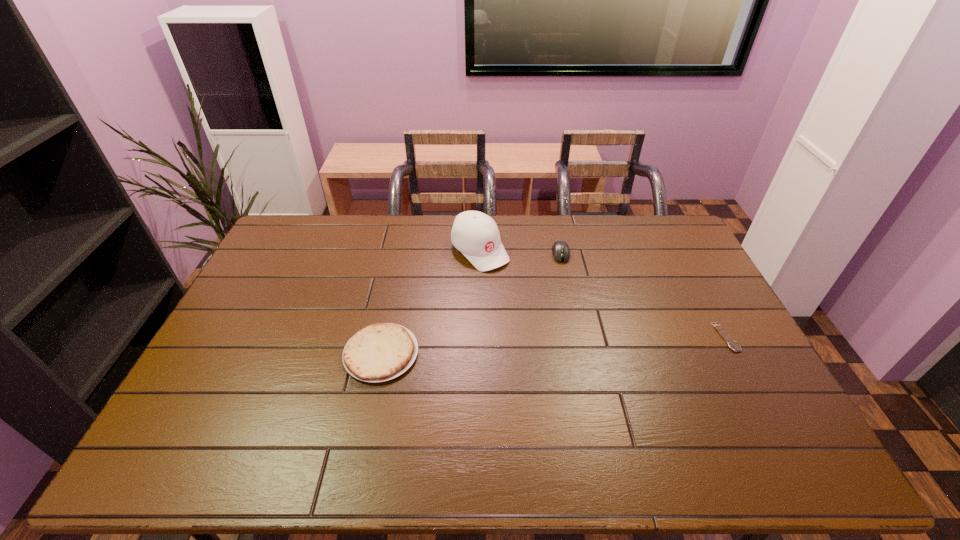
In order to click on vacant spot on the desktop that is between the leftmost object and the watch and is positioned on the wheel side of the computer mouse in this screenshot , I will do `click(575, 345)`.

This screenshot has width=960, height=540. Identify the location of free space on the desktop that is between the tortilla and the shortest object and is positioned on the front-facing side of the tallest object. (575, 345).